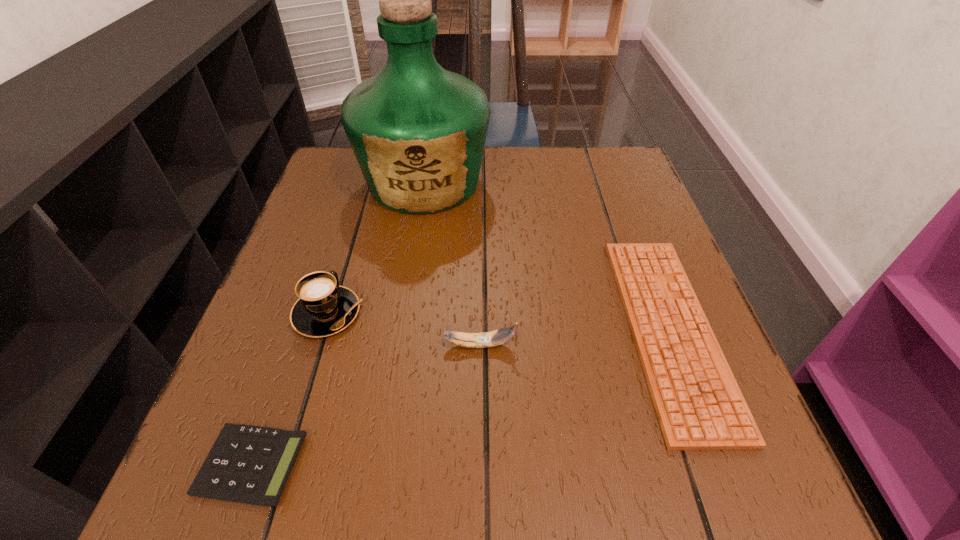
Where is `free region located on the right of the calculator`? The height and width of the screenshot is (540, 960). free region located on the right of the calculator is located at coordinates (552, 464).

The image size is (960, 540). Find the location of `object that is at the far edge`. object that is at the far edge is located at coordinates (418, 131).

The width and height of the screenshot is (960, 540). Identify the location of computer keyboard located in the near edge section of the desktop. (699, 405).

This screenshot has height=540, width=960. I want to click on calculator at the near edge, so click(247, 464).

This screenshot has height=540, width=960. In order to click on liquor that is at the left edge in this screenshot , I will do `click(418, 131)`.

At what (x,y) coordinates should I click in order to perform the action: click on cappuccino that is at the left edge. Please return your answer as a coordinate pair (x, y). This screenshot has height=540, width=960. Looking at the image, I should click on (324, 308).

This screenshot has height=540, width=960. I want to click on calculator that is at the left edge, so click(247, 464).

I want to click on object present at the right edge, so click(699, 405).

Find the location of a particular element. object that is at the far left corner is located at coordinates (418, 131).

Identify the location of object present at the near left corner. This screenshot has height=540, width=960. (247, 464).